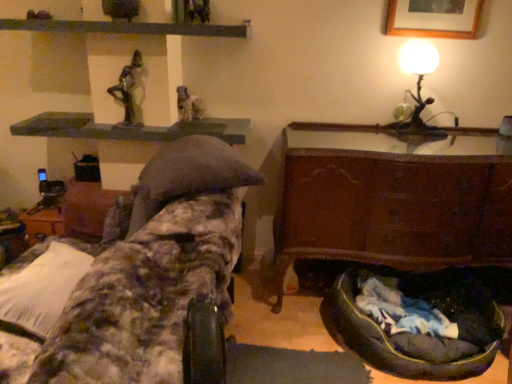
Question: Is metallic matte table lamp at upper right outside wooden picture frame at upper right?

Choices:
 (A) no
 (B) yes

Answer: (B)

Question: Does metallic matte table lamp at upper right appear on the left side of wooden picture frame at upper right?

Choices:
 (A) no
 (B) yes

Answer: (B)

Question: From a real-world perspective, is metallic matte table lamp at upper right physically above wooden picture frame at upper right?

Choices:
 (A) yes
 (B) no

Answer: (B)

Question: Is metallic matte table lamp at upper right at the right side of wooden picture frame at upper right?

Choices:
 (A) no
 (B) yes

Answer: (A)

Question: Is metallic matte table lamp at upper right smaller than wooden picture frame at upper right?

Choices:
 (A) yes
 (B) no

Answer: (B)

Question: From a real-world perspective, relative to matte stone statue at upper center, marked as the 2th sculpture in a front-to-back arrangement, is wooden picture frame at upper right vertically above or below?

Choices:
 (A) above
 (B) below

Answer: (A)

Question: Is wooden picture frame at upper right taller or shorter than matte stone statue at upper center, arranged as the 2th sculpture when viewed from the left?

Choices:
 (A) tall
 (B) short

Answer: (A)

Question: In the image, is wooden picture frame at upper right positioned in front of or behind matte stone statue at upper center, arranged as the 2th sculpture when viewed from the left?

Choices:
 (A) front
 (B) behind

Answer: (A)

Question: Considering the relative positions of wooden picture frame at upper right and matte stone statue at upper center, the first sculpture positioned from the right, in the image provided, is wooden picture frame at upper right to the left or to the right of matte stone statue at upper center, the first sculpture positioned from the right,?

Choices:
 (A) left
 (B) right

Answer: (B)

Question: Considering the positions of wooden picture frame at upper right and dark gray fabric bean bag at lower right in the image, is wooden picture frame at upper right wider or thinner than dark gray fabric bean bag at lower right?

Choices:
 (A) thin
 (B) wide

Answer: (A)

Question: Choose the correct answer: Is wooden picture frame at upper right inside dark gray fabric bean bag at lower right or outside it?

Choices:
 (A) inside
 (B) outside

Answer: (B)

Question: From the image's perspective, is wooden picture frame at upper right located above or below dark gray fabric bean bag at lower right?

Choices:
 (A) below
 (B) above

Answer: (B)

Question: Relative to dark gray fabric bean bag at lower right, is wooden picture frame at upper right in front or behind?

Choices:
 (A) front
 (B) behind

Answer: (B)

Question: Is green matte shelf at upper center, which is the 1th shelf in top-to-bottom order, inside the boundaries of dark gray fabric bean bag at lower right, or outside?

Choices:
 (A) inside
 (B) outside

Answer: (B)

Question: Visually, is green matte shelf at upper center, the second shelf in the bottom-to-top sequence, positioned to the left or to the right of dark gray fabric bean bag at lower right?

Choices:
 (A) right
 (B) left

Answer: (B)